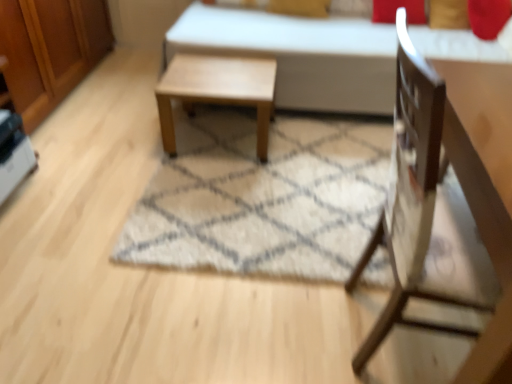
Locate an element on the screen. The width and height of the screenshot is (512, 384). free space to the left of wooden chair at right is located at coordinates (281, 330).